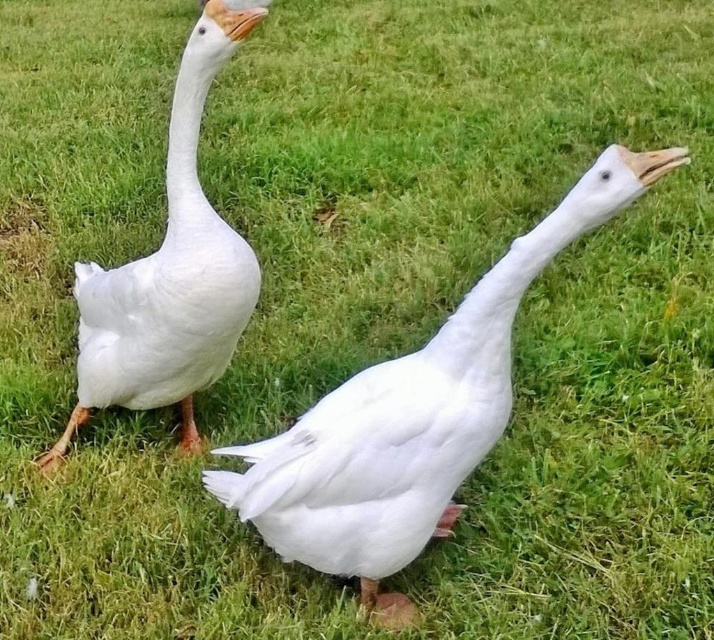
Question: Does white matte duck at center appear on the left side of white matte duck at left?

Choices:
 (A) yes
 (B) no

Answer: (B)

Question: Where is white matte duck at center located in relation to white matte duck at left in the image?

Choices:
 (A) right
 (B) left

Answer: (A)

Question: Does white matte duck at center have a larger size compared to white matte duck at left?

Choices:
 (A) no
 (B) yes

Answer: (A)

Question: Which object is farther from the camera taking this photo?

Choices:
 (A) white matte duck at center
 (B) white matte duck at left

Answer: (B)

Question: Which of the following is the closest to the observer?

Choices:
 (A) white matte duck at left
 (B) white matte duck at center

Answer: (B)